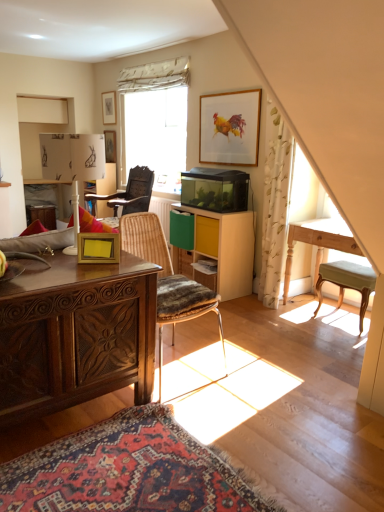
Where is `free space to the left of wooden photo frame at center, which is counted as the 1th picture frame, starting from the bottom`? free space to the left of wooden photo frame at center, which is counted as the 1th picture frame, starting from the bottom is located at coordinates (64, 255).